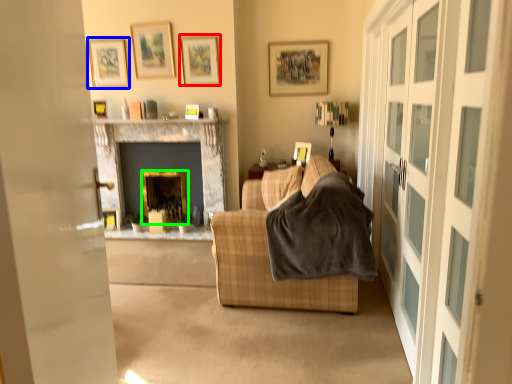
Question: Which is nearer to the picture frame (highlighted by a red box)? picture frame (highlighted by a blue box) or fireplace (highlighted by a green box).

Choices:
 (A) picture frame
 (B) fireplace

Answer: (A)